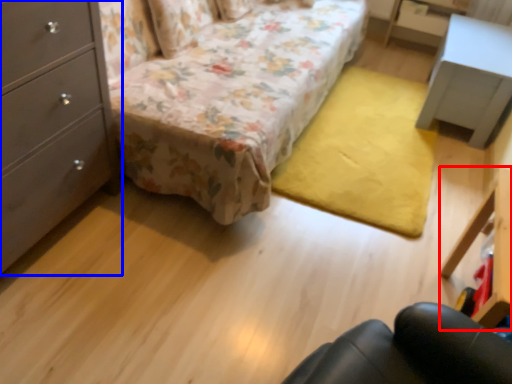
Question: Which object appears closest to the camera in this image, vanity (highlighted by a red box) or chest of drawers (highlighted by a blue box)?

Choices:
 (A) vanity
 (B) chest of drawers

Answer: (B)